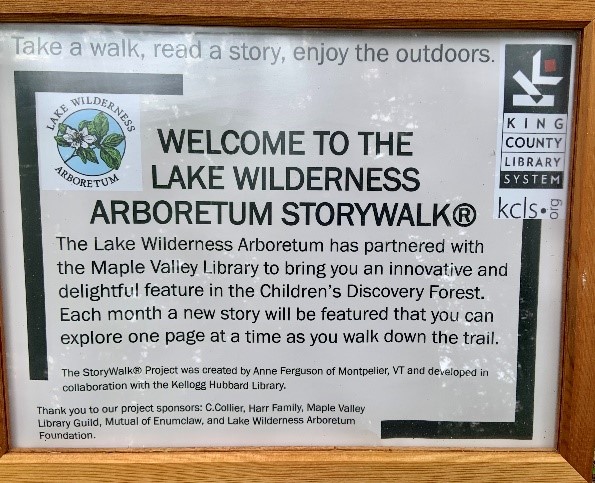
Identify the location of frame. (501, 6).